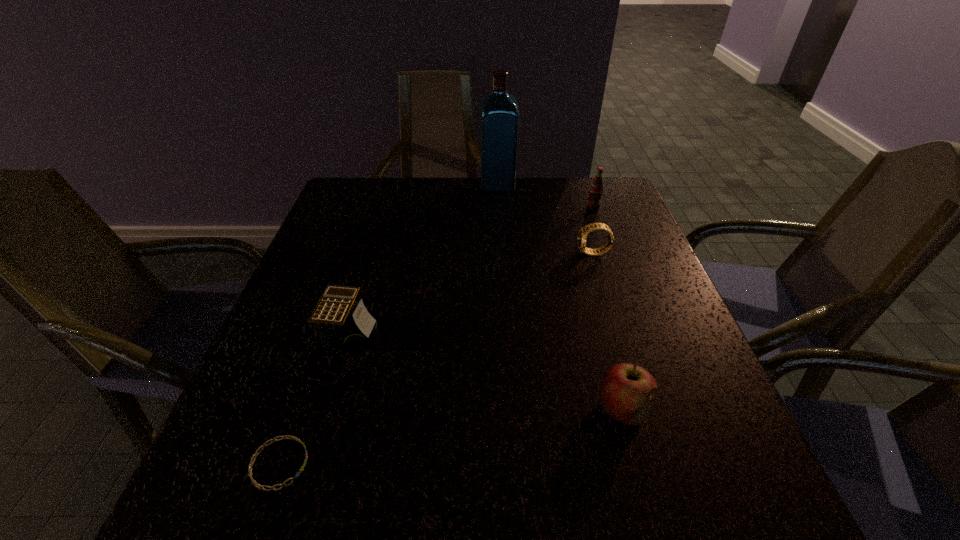
Where is `the third object from left to right`? the third object from left to right is located at coordinates (499, 110).

Locate an element on the screen. Image resolution: width=960 pixels, height=540 pixels. liquor is located at coordinates (499, 110).

The height and width of the screenshot is (540, 960). I want to click on the fifth nearest object, so click(x=596, y=188).

Locate an element on the screen. This screenshot has width=960, height=540. soda is located at coordinates [x=596, y=188].

Find the location of a particular element. the second nearest object is located at coordinates click(626, 390).

Find the location of a particular element. Image resolution: width=960 pixels, height=540 pixels. the fourth farthest object is located at coordinates (344, 325).

Locate an element on the screen. The width and height of the screenshot is (960, 540). watch is located at coordinates (582, 235).

In order to click on bracelet in this screenshot , I will do `click(254, 482)`.

Image resolution: width=960 pixels, height=540 pixels. What are the coordinates of `the nearest object` in the screenshot? It's located at (254, 482).

Identify the location of vacant space located 0.220m on the flat label side of the farthest object. The height and width of the screenshot is (540, 960). (409, 185).